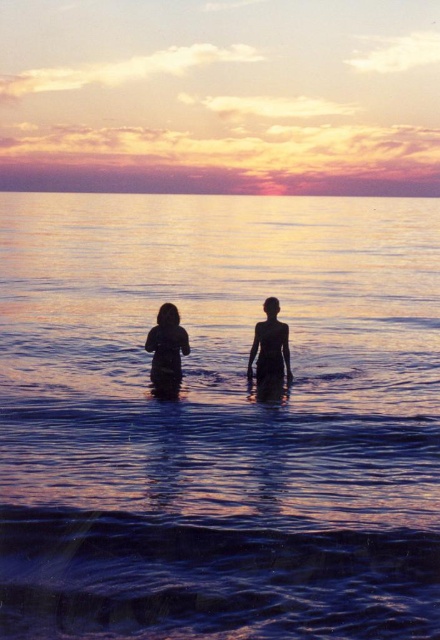
Question: Is silhouette figures at center below silhouette skin at center?

Choices:
 (A) no
 (B) yes

Answer: (A)

Question: Can you confirm if blue liquid water at center is wider than silhouette figures at center?

Choices:
 (A) no
 (B) yes

Answer: (B)

Question: Considering the relative positions of silhouette figures at center and silhouette skin at center in the image provided, where is silhouette figures at center located with respect to silhouette skin at center?

Choices:
 (A) below
 (B) above

Answer: (B)

Question: Which object appears closest to the camera in this image?

Choices:
 (A) silhouette figures at center
 (B) silhouette skin at center

Answer: (B)

Question: Considering the real-world distances, which object is farthest from the blue liquid water at center?

Choices:
 (A) silhouette figures at center
 (B) dark matte figure at center

Answer: (A)

Question: Among these points, which one is nearest to the camera?

Choices:
 (A) (260, 349)
 (B) (330, 497)

Answer: (B)